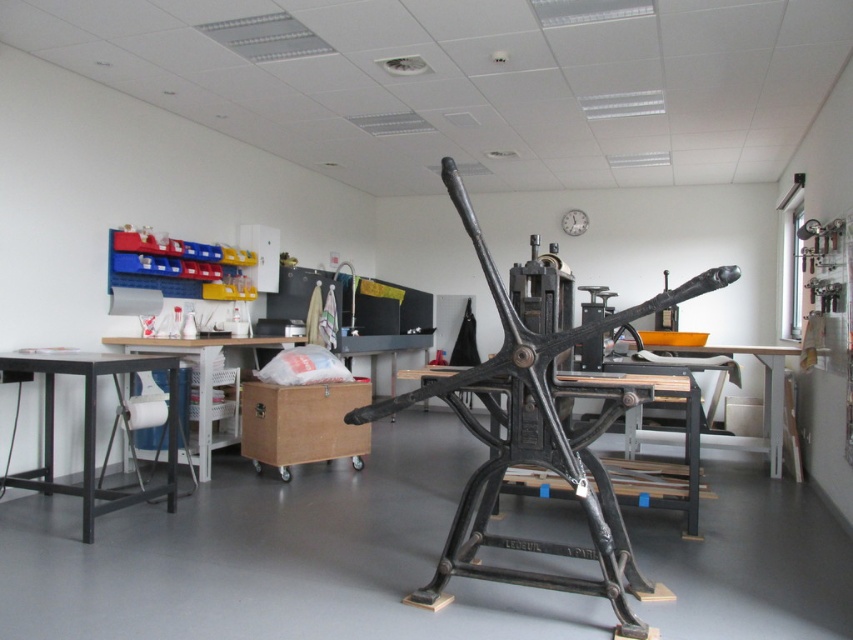
Question: Which point is farther from the camera taking this photo?

Choices:
 (A) (51, 410)
 (B) (184, 342)
 (C) (640, 438)

Answer: (C)

Question: Which of these objects is positioned closest to the black metal table at left?

Choices:
 (A) wooden table at center
 (B) black cast iron press at center
 (C) black metal table at center

Answer: (B)

Question: Is black metal table at center further to the viewer compared to wooden table at center?

Choices:
 (A) no
 (B) yes

Answer: (A)

Question: Is the position of black metal table at left less distant than that of wooden table at center?

Choices:
 (A) yes
 (B) no

Answer: (A)

Question: Is black metal table at center thinner than wooden table at center?

Choices:
 (A) yes
 (B) no

Answer: (B)

Question: Which of these objects is positioned closest to the black metal table at center?

Choices:
 (A) white plastic table at left
 (B) wooden table at center
 (C) black metal table at left
 (D) black cast iron press at center

Answer: (D)